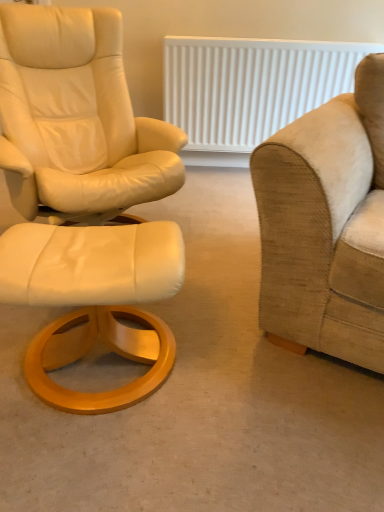
This screenshot has height=512, width=384. Describe the element at coordinates (201, 396) in the screenshot. I see `matte white ottoman at left` at that location.

The image size is (384, 512). Find the location of `beige fabric couch at right`. beige fabric couch at right is located at coordinates (326, 224).

Does matte white ottoman at left have a greater height compared to beige fabric couch at right?

Incorrect, the height of matte white ottoman at left is not larger of that of beige fabric couch at right.

From the picture: Is matte white ottoman at left positioned beyond the bounds of beige fabric couch at right?

Yes, matte white ottoman at left is outside of beige fabric couch at right.

Are matte white ottoman at left and beige fabric couch at right far apart?

No.

Can you tell me how much matte white ottoman at left and beige fabric couch at right differ in facing direction?

The angular difference between matte white ottoman at left and beige fabric couch at right is 115 degrees.

The image size is (384, 512). In the image, there is a white leather ottoman at left. In order to click on concrete above it (from the image's perspective) in this screenshot , I will do `click(201, 396)`.

Is point (263, 360) farther from camera compared to point (85, 244)?

That is True.

Which object is closer to the camera taking this photo, white textured radiator at upper center or matte white ottoman at left?

matte white ottoman at left is closer to the camera.

Is white textured radiator at upper center aimed at matte white ottoman at left?

Yes, white textured radiator at upper center is turned towards matte white ottoman at left.

From the image's perspective, is white textured radiator at upper center located above or below matte white ottoman at left?

Based on their image positions, white textured radiator at upper center is located above matte white ottoman at left.

Which is further, (177,94) or (191,316)?

Positioned behind is point (177,94).

Image resolution: width=384 pixels, height=512 pixels. I want to click on radiator behind the matte white ottoman at left, so click(x=251, y=86).

From the picture: From the image's perspective, which one is positioned higher, matte white ottoman at left or white textured radiator at upper center?

white textured radiator at upper center.

Based on their positions, is matte white ottoman at left located to the left or right of white textured radiator at upper center?

matte white ottoman at left is positioned on white textured radiator at upper center's left side.

How different are the orientations of matte white ottoman at left and white textured radiator at upper center in degrees?

There is a 89.7-degree angle between the facing directions of matte white ottoman at left and white textured radiator at upper center.

Which is behind, point (295, 139) or point (76, 267)?

The point (295, 139) is farther.

Based on their sizes in the image, would you say beige fabric couch at right is bigger or smaller than white leather ottoman at left?

Clearly, beige fabric couch at right is larger in size than white leather ottoman at left.

Which object is closer to the camera, beige fabric couch at right or white leather ottoman at left?

beige fabric couch at right.

Visually, is beige fabric couch at right positioned to the left or to the right of white leather ottoman at left?

Clearly, beige fabric couch at right is on the right of white leather ottoman at left in the image.

Is point (283, 68) behind point (30, 265)?

Yes.

Consider the image. Which is more to the right, white textured radiator at upper center or white leather ottoman at left?

Positioned to the right is white textured radiator at upper center.

Which of these two, white textured radiator at upper center or white leather ottoman at left, is wider?

Wider between the two is white leather ottoman at left.

From the image's perspective, is beige fabric couch at right located above matte white ottoman at left?

Yes, from the image's perspective, beige fabric couch at right is on top of matte white ottoman at left.

Is beige fabric couch at right outside of matte white ottoman at left?

beige fabric couch at right lies outside matte white ottoman at left's area.

Is beige fabric couch at right wider than matte white ottoman at left?

No.

You are a GUI agent. You are given a task and a screenshot of the screen. Output one action in this format:
    pyautogui.click(x=<x>, y=<y>)
    Task: Click on the concrete below the beige fabric couch at right (from a real-world perspective)
    
    Given the screenshot: What is the action you would take?
    pyautogui.click(x=201, y=396)

Where is `stool behind the matte white ottoman at left`? Image resolution: width=384 pixels, height=512 pixels. stool behind the matte white ottoman at left is located at coordinates (94, 300).

When comparing their distances from matte white ottoman at left, does white textured radiator at upper center or beige fabric couch at right seem further?

The object further to matte white ottoman at left is white textured radiator at upper center.

Based on their spatial positions, is white leather ottoman at left or beige fabric couch at right further from matte white ottoman at left?

beige fabric couch at right.

Looking at the image, which one is located further to beige fabric couch at right, matte white ottoman at left or white leather ottoman at left?

white leather ottoman at left is positioned further to the anchor beige fabric couch at right.

Which object lies nearer to the anchor point white leather ottoman at left, white textured radiator at upper center or beige fabric couch at right?

beige fabric couch at right is closer to white leather ottoman at left.

Which object lies further to the anchor point matte white ottoman at left, white textured radiator at upper center or white leather ottoman at left?

white textured radiator at upper center is positioned further to the anchor matte white ottoman at left.

Which object lies nearer to the anchor point white leather ottoman at left, beige fabric couch at right or matte white ottoman at left?

The object closer to white leather ottoman at left is matte white ottoman at left.

From the image, which object appears to be nearer to white leather ottoman at left, matte white ottoman at left or beige fabric couch at right?

matte white ottoman at left is positioned closer to the anchor white leather ottoman at left.

Based on their spatial positions, is white leather ottoman at left or matte white ottoman at left further from beige fabric couch at right?

white leather ottoman at left lies further to beige fabric couch at right than the other object.

Locate an element on the screen. Image resolution: width=384 pixels, height=512 pixels. concrete between beige fabric couch at right and white textured radiator at upper center along the z-axis is located at coordinates (201, 396).

Image resolution: width=384 pixels, height=512 pixels. In order to click on stool between matte white ottoman at left and white textured radiator at upper center from front to back in this screenshot , I will do `click(94, 300)`.

What are the coordinates of `stool between matte white ottoman at left and beige fabric couch at right in the horizontal direction` in the screenshot? It's located at (94, 300).

Locate an element on the screen. The width and height of the screenshot is (384, 512). stool positioned between beige fabric couch at right and white textured radiator at upper center from near to far is located at coordinates (94, 300).